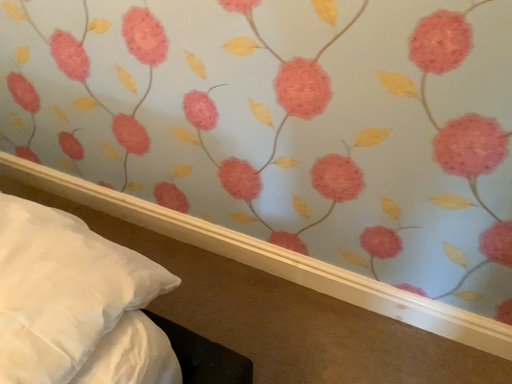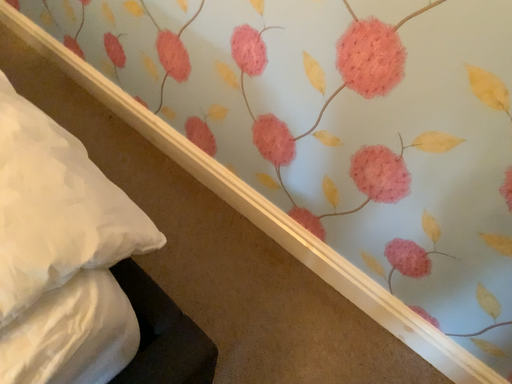
Question: How did the camera likely rotate when shooting the video?

Choices:
 (A) rotated downward
 (B) rotated upward

Answer: (A)